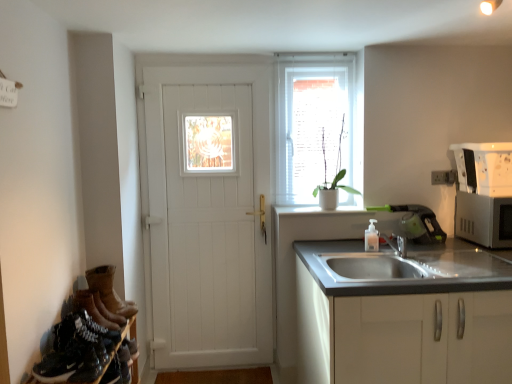
Find the location of a particular element. blank space situated above white wooden door at center (from a real-world perspective) is located at coordinates (215, 60).